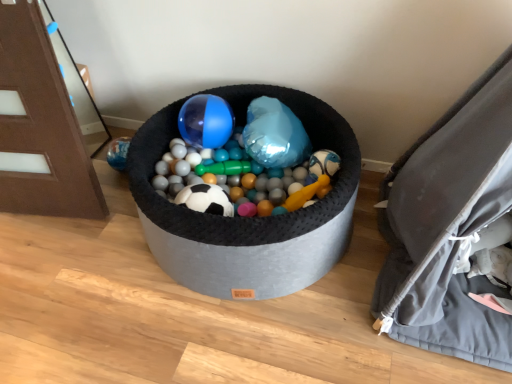
Question: Does point (258, 231) appear closer or farther from the camera than point (510, 158)?

Choices:
 (A) farther
 (B) closer

Answer: (A)

Question: Considering the positions of translucent plastic ball at center and gray fabric bean bag chair at right in the image, is translucent plastic ball at center taller or shorter than gray fabric bean bag chair at right?

Choices:
 (A) short
 (B) tall

Answer: (A)

Question: Estimate the real-world distances between objects in this image. Which object is closer to the translucent plastic ball at center?

Choices:
 (A) brushed wood door at left
 (B) gray fabric bean bag chair at right

Answer: (B)

Question: Based on their relative distances, which object is farther from the gray fabric bean bag chair at right?

Choices:
 (A) translucent plastic ball at center
 (B) brushed wood door at left

Answer: (B)